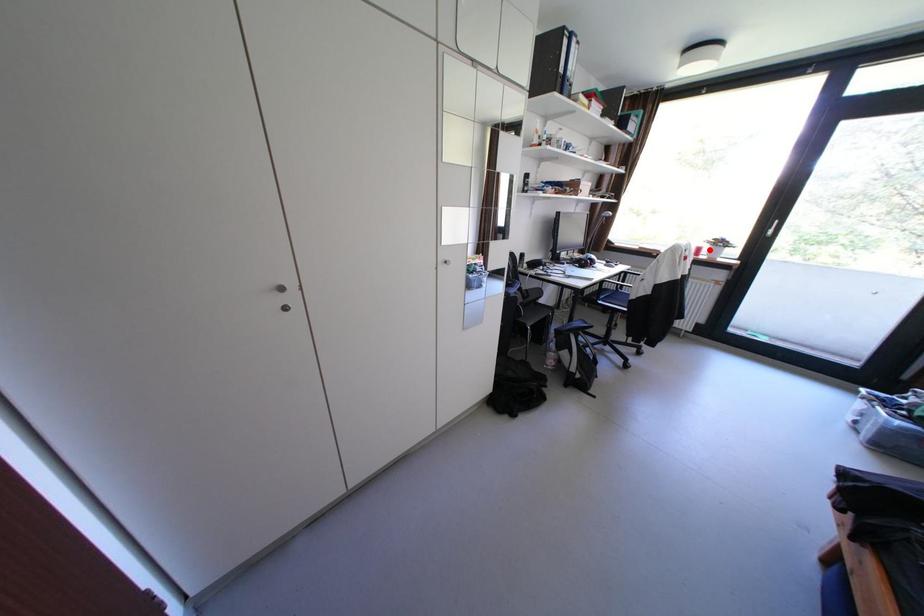
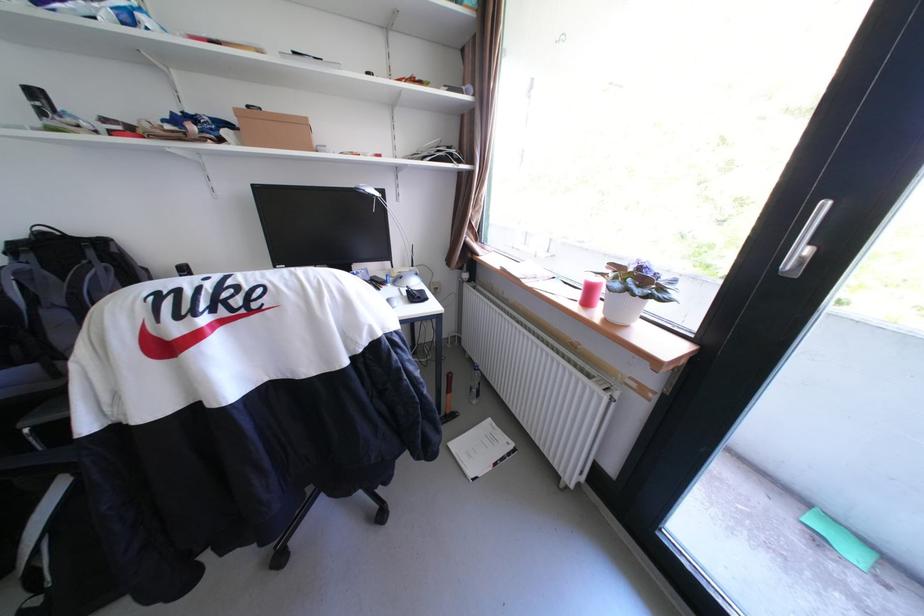
Where in the second image is the point corresponding to the highlighted location from the first image?

(601, 291)